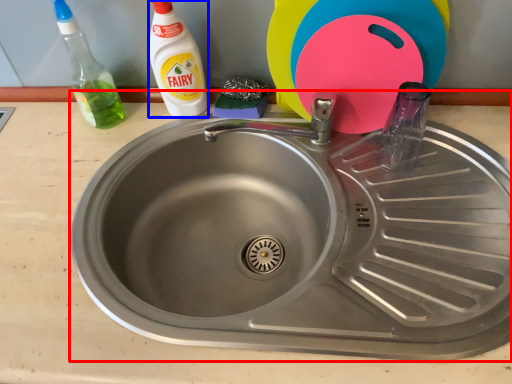
Question: Which object is further to the camera taking this photo, sink (highlighted by a red box) or cleaning product (highlighted by a blue box)?

Choices:
 (A) sink
 (B) cleaning product

Answer: (B)